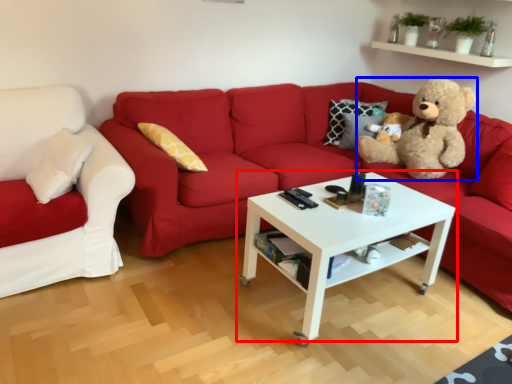
Question: Which of the following is the farthest to the observer, coffee table (highlighted by a red box) or teddy bear (highlighted by a blue box)?

Choices:
 (A) coffee table
 (B) teddy bear

Answer: (B)